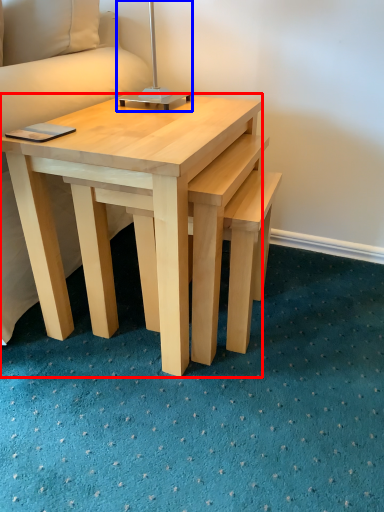
Question: Which of the following is the closest to the observer, coffee table (highlighted by a red box) or bedside lamp (highlighted by a blue box)?

Choices:
 (A) coffee table
 (B) bedside lamp

Answer: (A)